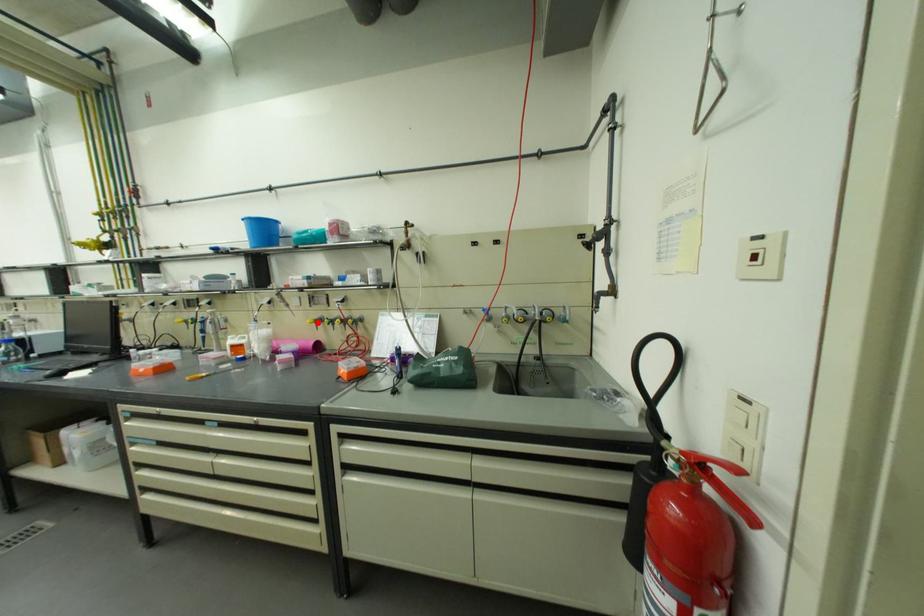
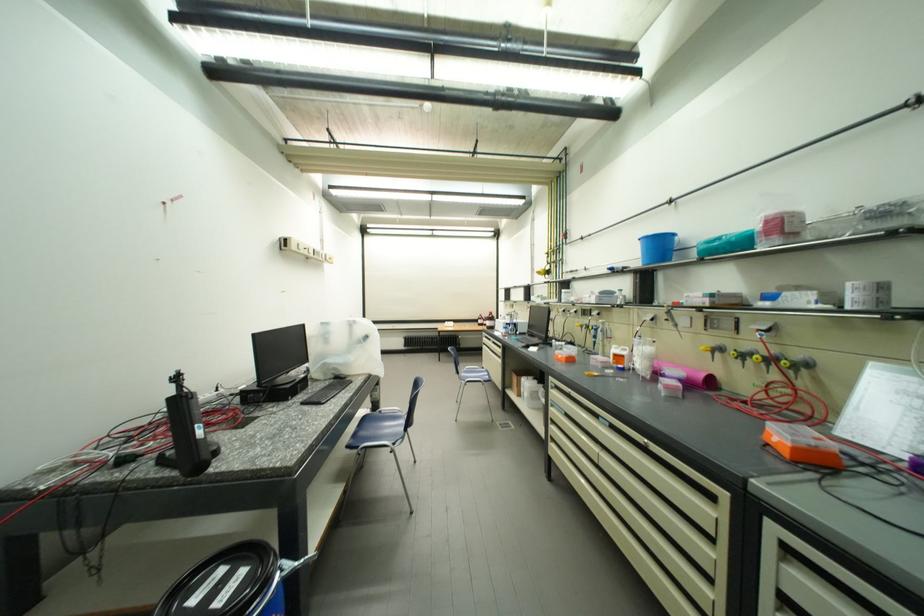
Find the pixel in the second image that matches the highlighted location in the first image.

(712, 350)